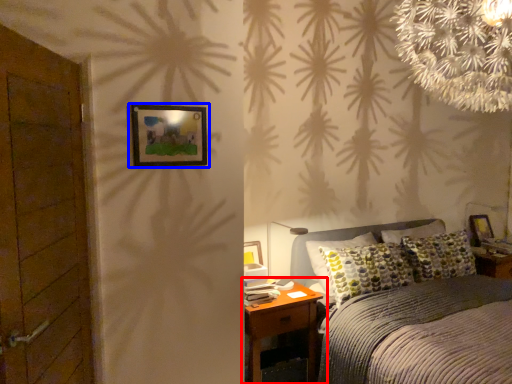
Question: Which of the following is the closest to the observer, nightstand (highlighted by a red box) or picture frame (highlighted by a blue box)?

Choices:
 (A) nightstand
 (B) picture frame

Answer: (B)